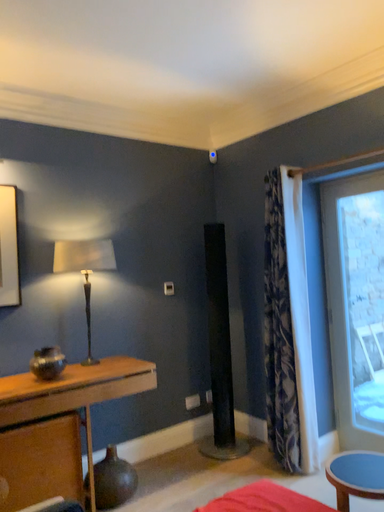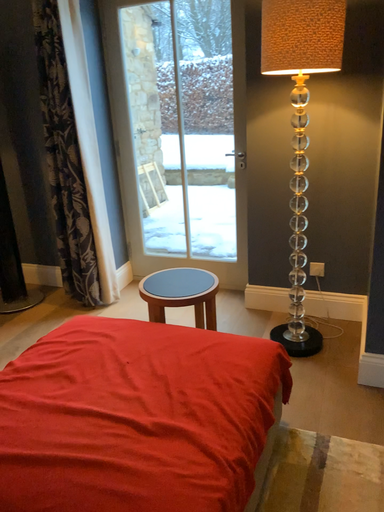
Question: Which way did the camera rotate in the video?

Choices:
 (A) rotated downward
 (B) rotated upward

Answer: (A)